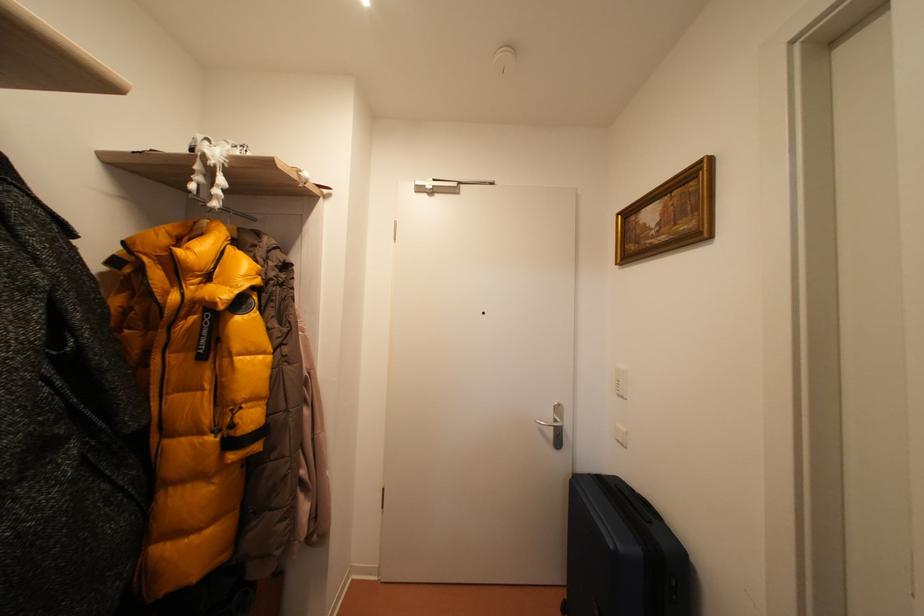
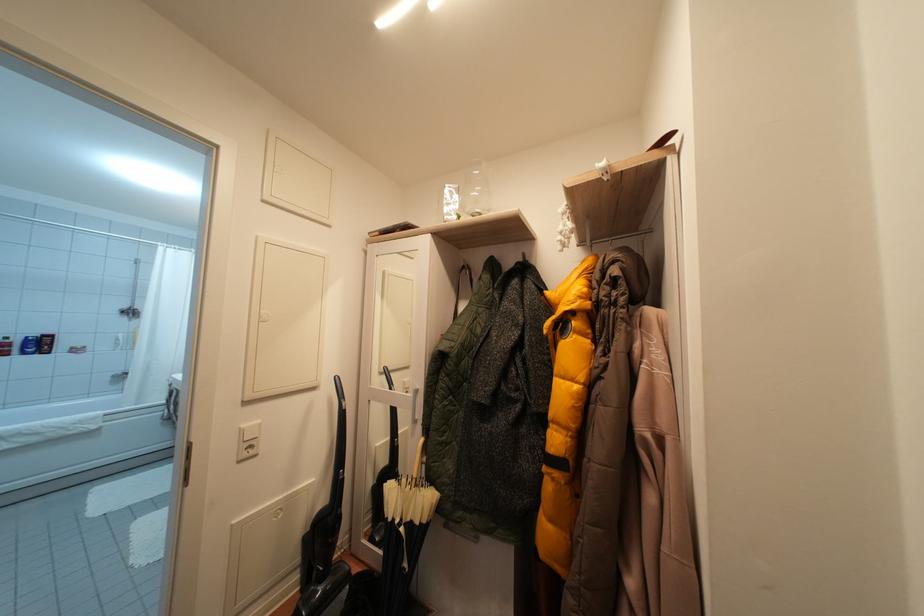
Question: The images are taken continuously from a first-person perspective. In which direction is your viewpoint rotating?

Choices:
 (A) Left
 (B) Right
 (C) Up
 (D) Down

Answer: (A)